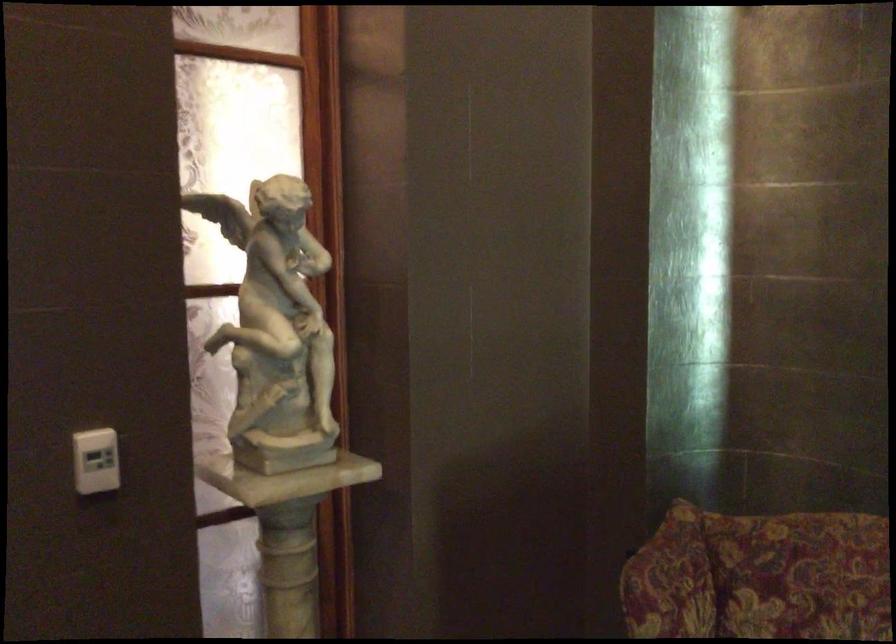
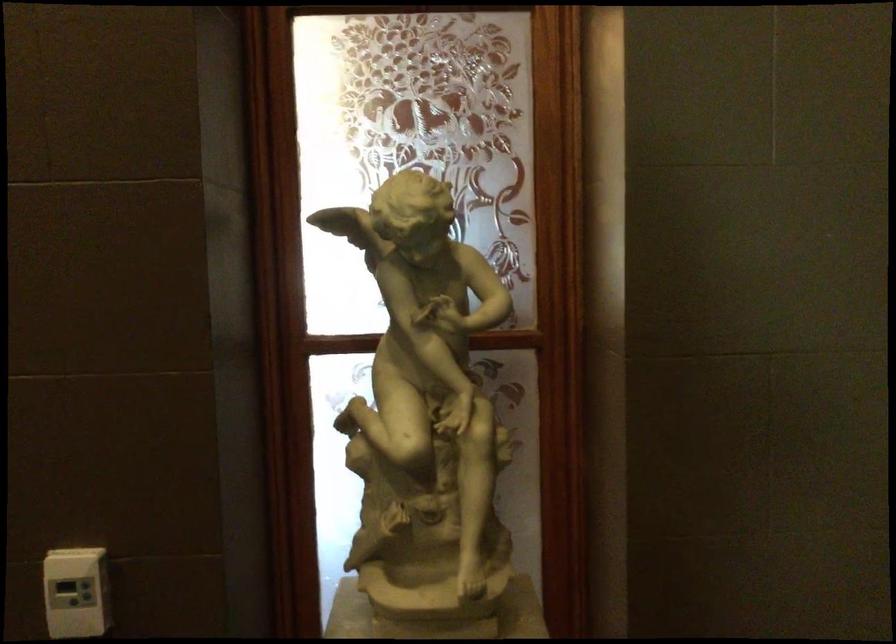
Question: How did the camera likely rotate?

Choices:
 (A) Left
 (B) Right
 (C) Up
 (D) Down

Answer: (A)